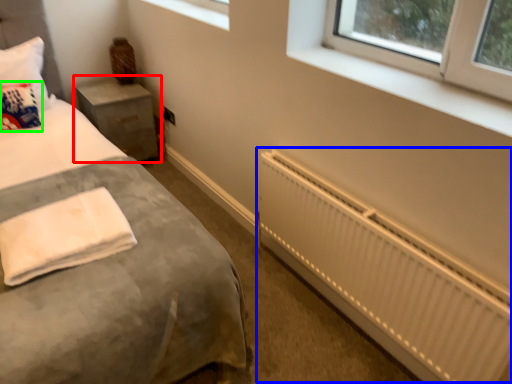
Question: Considering the real-world distances, which object is farthest from nightstand (highlighted by a red box)? radiator (highlighted by a blue box) or throw pillow (highlighted by a green box)?

Choices:
 (A) radiator
 (B) throw pillow

Answer: (A)